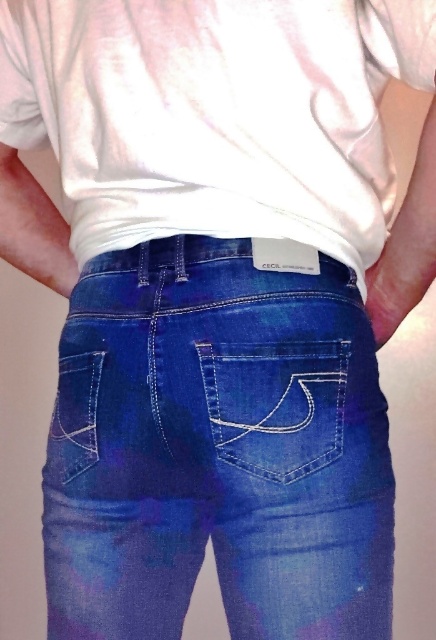
Question: Which of the following is the farthest from the observer?

Choices:
 (A) (78, 349)
 (B) (252, 378)
 (C) (82, 417)
 (D) (95, 28)

Answer: (A)

Question: Can you confirm if denim pocket at center is positioned to the left of denim pocket at lower left?

Choices:
 (A) yes
 (B) no

Answer: (B)

Question: Can you confirm if white matte t-shirt at center is positioned above denim pocket at lower left?

Choices:
 (A) no
 (B) yes

Answer: (B)

Question: Considering the relative positions of denim pocket at center and denim pocket at lower left in the image provided, where is denim pocket at center located with respect to denim pocket at lower left?

Choices:
 (A) above
 (B) below

Answer: (A)

Question: Which point is closer to the camera?

Choices:
 (A) denim pocket at lower left
 (B) white matte t-shirt at center

Answer: (B)

Question: Which object is the farthest from the denim pocket at lower left?

Choices:
 (A) denim pocket at center
 (B) denim at center
 (C) white matte t-shirt at center

Answer: (C)